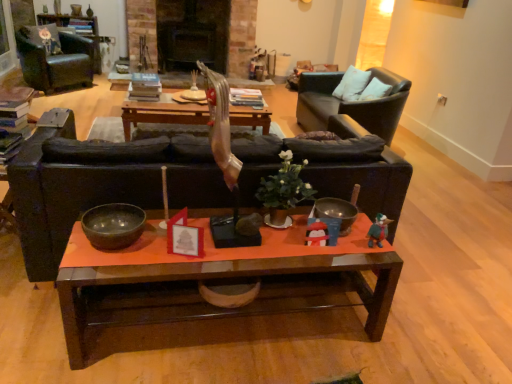
The width and height of the screenshot is (512, 384). In order to click on free space below shiny brown wooden coffee table at center, which appears as the 2th coffee table when viewed from the back (from a real-world perspective) in this screenshot , I will do `click(231, 317)`.